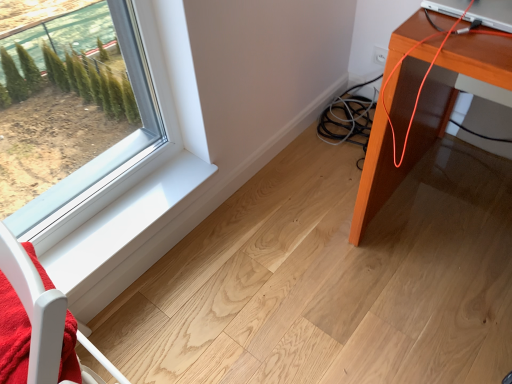
Question: From the image's perspective, is orange wood table at right on white wood chair at lower left?

Choices:
 (A) no
 (B) yes

Answer: (B)

Question: Considering the relative sizes of orange wood table at right and white wood chair at lower left in the image provided, is orange wood table at right taller than white wood chair at lower left?

Choices:
 (A) yes
 (B) no

Answer: (A)

Question: Is there a large distance between orange wood table at right and white wood chair at lower left?

Choices:
 (A) yes
 (B) no

Answer: (B)

Question: Is orange wood table at right bigger than white wood chair at lower left?

Choices:
 (A) yes
 (B) no

Answer: (A)

Question: Is orange wood table at right positioned beyond the bounds of white wood chair at lower left?

Choices:
 (A) yes
 (B) no

Answer: (A)

Question: Is orange wood table at right oriented towards white wood chair at lower left?

Choices:
 (A) yes
 (B) no

Answer: (A)

Question: From a real-world perspective, is white smooth window sill at lower left positioned under white wood chair at lower left based on gravity?

Choices:
 (A) no
 (B) yes

Answer: (B)

Question: Is white smooth window sill at lower left positioned with its back to white wood chair at lower left?

Choices:
 (A) yes
 (B) no

Answer: (B)

Question: Is white smooth window sill at lower left shorter than white wood chair at lower left?

Choices:
 (A) no
 (B) yes

Answer: (B)

Question: Could you tell me if white smooth window sill at lower left is facing white wood chair at lower left?

Choices:
 (A) yes
 (B) no

Answer: (B)

Question: Is white wood chair at lower left surrounded by white smooth window sill at lower left?

Choices:
 (A) yes
 (B) no

Answer: (B)

Question: Considering the relative positions of white smooth window sill at lower left and white wood chair at lower left in the image provided, is white smooth window sill at lower left to the left of white wood chair at lower left from the viewer's perspective?

Choices:
 (A) no
 (B) yes

Answer: (A)

Question: From the image's perspective, does silver metallic laptop at upper right appear higher than white smooth window sill at lower left?

Choices:
 (A) yes
 (B) no

Answer: (A)